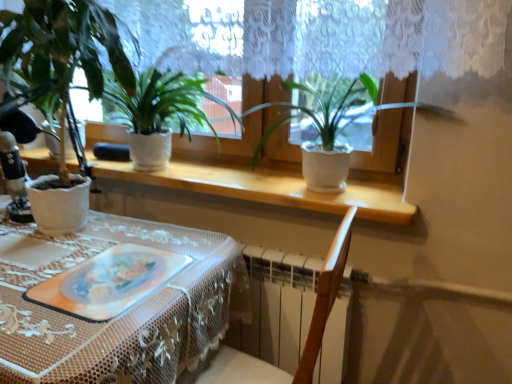
Question: Considering the positions of white textured pot at left, the 1th houseplant in the left-to-right sequence, and translucent plastic platter at center in the image, is white textured pot at left, the 1th houseplant in the left-to-right sequence, wider or thinner than translucent plastic platter at center?

Choices:
 (A) thin
 (B) wide

Answer: (B)

Question: Is white textured pot at left, the 1th houseplant in the left-to-right sequence, bigger or smaller than translucent plastic platter at center?

Choices:
 (A) small
 (B) big

Answer: (B)

Question: Which is nearer to the white lace tablecloth at lower left?

Choices:
 (A) white matte pot at center, acting as the 1th houseplant starting from the right
 (B) translucent plastic platter at center
 (C) white textured pot at left, the 1th houseplant in the left-to-right sequence
 (D) matte white pot at center, which is the 2th houseplant from right to left
 (E) white textured pot at center

Answer: (B)

Question: Based on their relative distances, which object is farther from the matte white pot at center, placed as the second houseplant when sorted from left to right?

Choices:
 (A) white lace tablecloth at lower left
 (B) white textured pot at left, the 1th houseplant in the left-to-right sequence
 (C) translucent plastic platter at center
 (D) white textured pot at center
 (E) white matte pot at center, the third houseplant positioned from the left

Answer: (C)